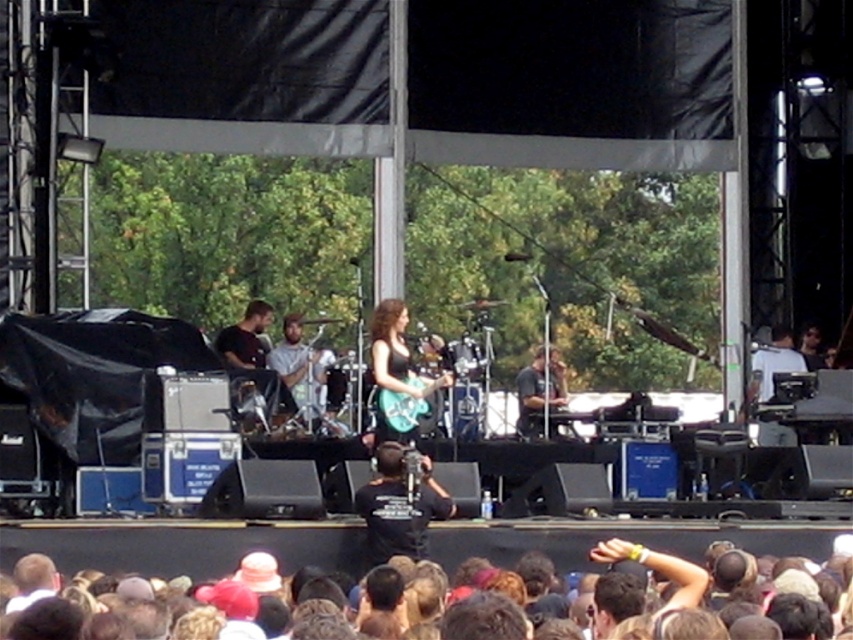
Question: Which object is the farthest from the shiny black guitar at center?

Choices:
 (A) dark brown hair at lower center
 (B) black t-shirt at center

Answer: (A)

Question: Is dark brown hair at lower center below shiny black guitar at center?

Choices:
 (A) no
 (B) yes

Answer: (B)

Question: Which point is closer to the camera?

Choices:
 (A) (392, 525)
 (B) (248, 531)

Answer: (B)

Question: Can you confirm if dark brown hair at lower center is positioned to the left of shiny black guitar at center?

Choices:
 (A) yes
 (B) no

Answer: (B)

Question: Which object is closer to the camera taking this photo?

Choices:
 (A) black t-shirt at center
 (B) shiny black guitar at center

Answer: (A)

Question: Is dark brown hair at lower center positioned behind black t-shirt at center?

Choices:
 (A) yes
 (B) no

Answer: (B)